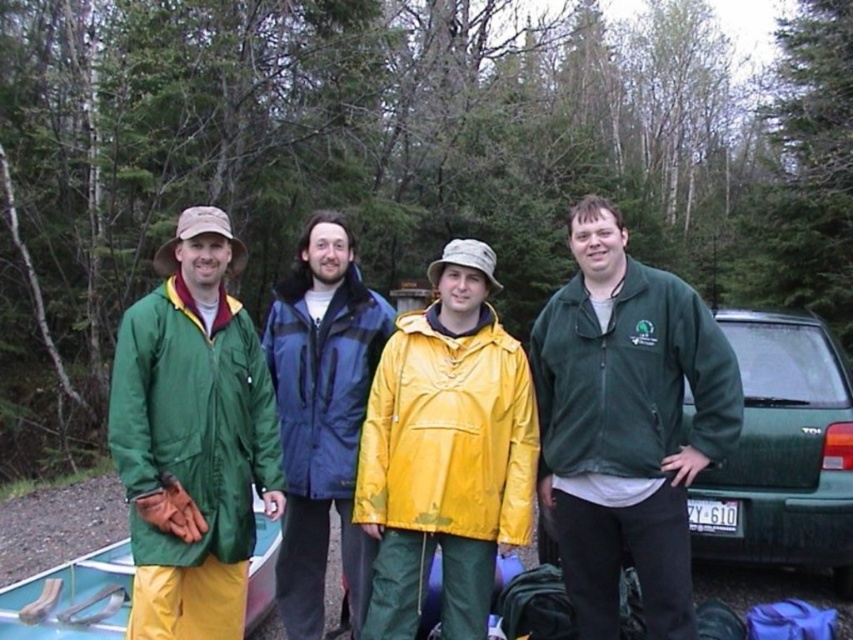
Question: Which object appears farthest from the camera in this image?

Choices:
 (A) green plastic canoe at lower left
 (B) green matte van at right
 (C) yellow waterproof jacket at center

Answer: (B)

Question: Estimate the real-world distances between objects in this image. Which object is closer to the green plastic canoe at lower left?

Choices:
 (A) yellow waterproof jacket at center
 (B) blue waterproof jacket at center

Answer: (B)

Question: Is blue waterproof jacket at center smaller than green plastic canoe at lower left?

Choices:
 (A) no
 (B) yes

Answer: (A)

Question: Which of the following is the closest to the observer?

Choices:
 (A) (300, 323)
 (B) (279, 522)
 (C) (505, 444)
 (D) (743, 352)

Answer: (C)

Question: Does green matte raincoat at left appear under yellow waterproof jacket at center?

Choices:
 (A) yes
 (B) no

Answer: (B)

Question: Observing the image, what is the correct spatial positioning of green fleece jacket at center in reference to green matte raincoat at left?

Choices:
 (A) left
 (B) right

Answer: (B)